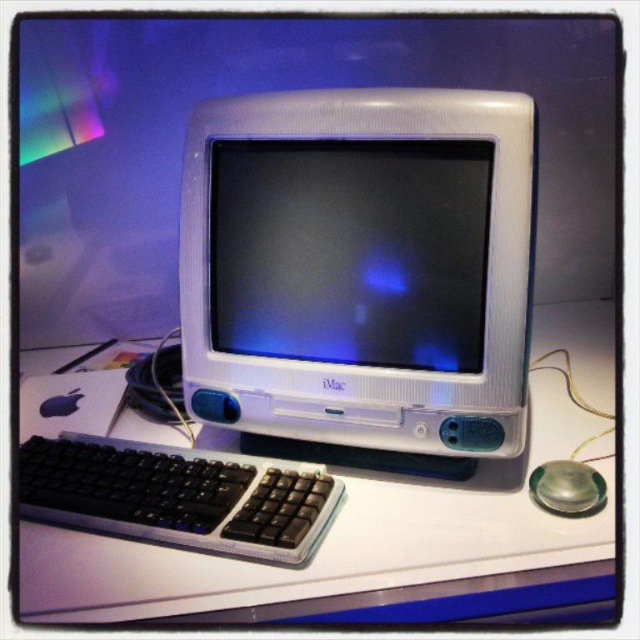
Which is more to the left, white glossy computer desk at center or white glossy monitor at center?

Positioned to the left is white glossy monitor at center.

Can you confirm if white glossy computer desk at center is taller than white glossy monitor at center?

Yes, white glossy computer desk at center is taller than white glossy monitor at center.

You are a GUI agent. You are given a task and a screenshot of the screen. Output one action in this format:
    pyautogui.click(x=<x>, y=<y>)
    Task: Click on the white glossy computer desk at center
    Image resolution: width=640 pixels, height=640 pixels.
    Given the screenshot: What is the action you would take?
    pyautogui.click(x=372, y=524)

Is white plastic monitor at center further to the viewer compared to white glossy computer desk at center?

Yes, it is.

Looking at this image, between white plastic monitor at center and white glossy computer desk at center, which one has less height?

Standing shorter between the two is white glossy computer desk at center.

The image size is (640, 640). Describe the element at coordinates (360, 268) in the screenshot. I see `white plastic monitor at center` at that location.

Where is `white plastic monitor at center`? white plastic monitor at center is located at coordinates (360, 268).

Is white glossy monitor at center bigger than black plastic keyboard at lower left?

Yes, white glossy monitor at center is bigger than black plastic keyboard at lower left.

Is white glossy monitor at center to the left of black plastic keyboard at lower left from the viewer's perspective?

No, white glossy monitor at center is not to the left of black plastic keyboard at lower left.

Does point (324, 205) come behind point (195, 458)?

No, it is not.

Identify the location of white glossy monitor at center. This screenshot has height=640, width=640. (349, 250).